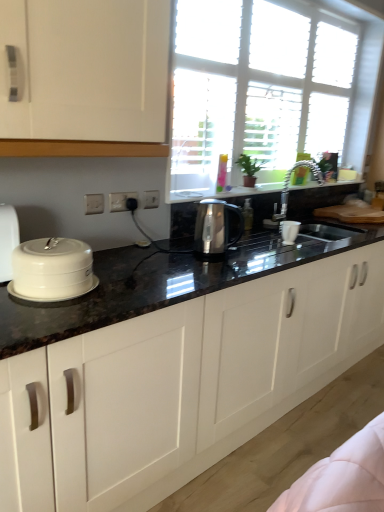
Question: Are white ceramic lid at left and white glossy cabinets at center beside each other?

Choices:
 (A) no
 (B) yes

Answer: (A)

Question: Can you confirm if white ceramic lid at left is smaller than white glossy cabinets at center?

Choices:
 (A) no
 (B) yes

Answer: (B)

Question: Is white ceramic lid at left bigger than white glossy cabinets at center?

Choices:
 (A) no
 (B) yes

Answer: (A)

Question: Considering the relative sizes of white ceramic lid at left and white glossy cabinets at center in the image provided, is white ceramic lid at left shorter than white glossy cabinets at center?

Choices:
 (A) no
 (B) yes

Answer: (B)

Question: Is white ceramic lid at left facing away from white glossy cabinets at center?

Choices:
 (A) no
 (B) yes

Answer: (A)

Question: Is the position of white ceramic lid at left more distant than that of white glossy cabinets at center?

Choices:
 (A) no
 (B) yes

Answer: (B)

Question: From the image's perspective, is white ceramic lid at left located above white plastic electric outlet at center, marked as the first electric outlet in a back-to-front arrangement?

Choices:
 (A) no
 (B) yes

Answer: (A)

Question: Is white ceramic lid at left completely or partially outside of white plastic electric outlet at center, positioned as the 1th electric outlet in right-to-left order?

Choices:
 (A) yes
 (B) no

Answer: (A)

Question: Is white ceramic lid at left bigger than white plastic electric outlet at center, the third electric outlet in the left-to-right sequence?

Choices:
 (A) yes
 (B) no

Answer: (A)

Question: Is white ceramic lid at left positioned far away from white plastic electric outlet at center, positioned as the 1th electric outlet in right-to-left order?

Choices:
 (A) no
 (B) yes

Answer: (A)

Question: Would you say white ceramic lid at left contains white plastic electric outlet at center, which appears as the 3th electric outlet when viewed from the front?

Choices:
 (A) yes
 (B) no

Answer: (B)

Question: Considering the relative positions of white ceramic lid at left and white plastic electric outlet at center, the third electric outlet in the left-to-right sequence, in the image provided, is white ceramic lid at left to the left of white plastic electric outlet at center, the third electric outlet in the left-to-right sequence, from the viewer's perspective?

Choices:
 (A) yes
 (B) no

Answer: (A)

Question: From the image's perspective, would you say satin metallic kettle at center is positioned over white plastic electric outlet at center, which is the 2th electric outlet in left-to-right order?

Choices:
 (A) no
 (B) yes

Answer: (A)